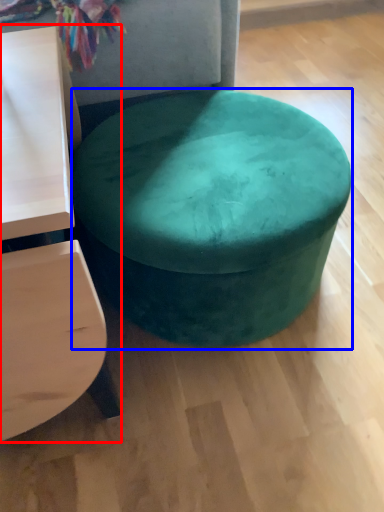
Question: Which of the following is the closest to the observer, table (highlighted by a red box) or stool (highlighted by a blue box)?

Choices:
 (A) table
 (B) stool

Answer: (A)